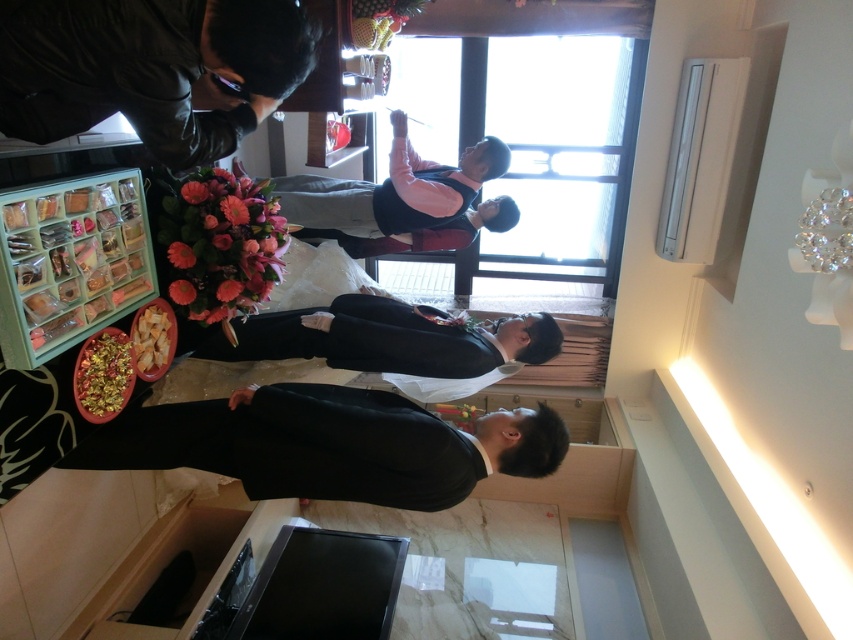
Which is more to the right, shiny gold tray at lower left or golden textured chips at lower left?

From the viewer's perspective, golden textured chips at lower left appears more on the right side.

Does shiny gold tray at lower left have a smaller size compared to golden textured chips at lower left?

No.

What do you see at coordinates (103, 374) in the screenshot?
I see `shiny gold tray at lower left` at bounding box center [103, 374].

Locate an element on the screen. shiny gold tray at lower left is located at coordinates [103, 374].

Can you confirm if black satin suit at lower center is wider than matte black dress at center?

Yes, black satin suit at lower center is wider than matte black dress at center.

Between point (369, 442) and point (283, 321), which one is positioned behind?

Positioned behind is point (283, 321).

The image size is (853, 640). Find the location of `black satin suit at lower center`. black satin suit at lower center is located at coordinates 328,444.

Between point (540, 332) and point (155, 353), which one is positioned behind?

Positioned behind is point (540, 332).

Identify the location of matte black dress at center. The width and height of the screenshot is (853, 640). (390, 339).

You are a GUI agent. You are given a task and a screenshot of the screen. Output one action in this format:
    pyautogui.click(x=<x>, y=<y>)
    Task: Click on the matte black dress at center
    
    Given the screenshot: What is the action you would take?
    pyautogui.click(x=390, y=339)